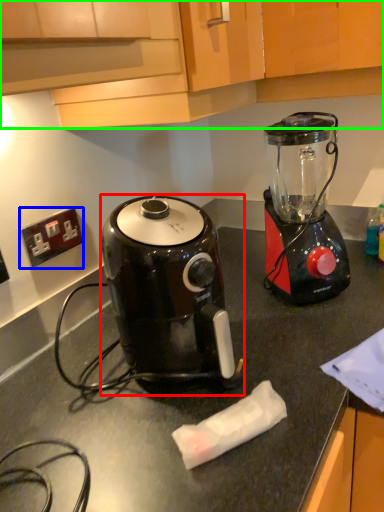
Question: Based on their relative distances, which object is nearer to coffee maker (highlighted by a red box)? Choose from power outlet (highlighted by a blue box) and cabinetry (highlighted by a green box).

Choices:
 (A) power outlet
 (B) cabinetry

Answer: (B)